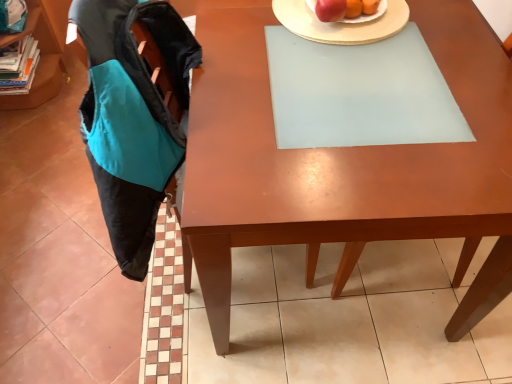
Find the location of a particular element. The height and width of the screenshot is (384, 512). vacant area that lies in front of white ceramic plate at upper center is located at coordinates (358, 86).